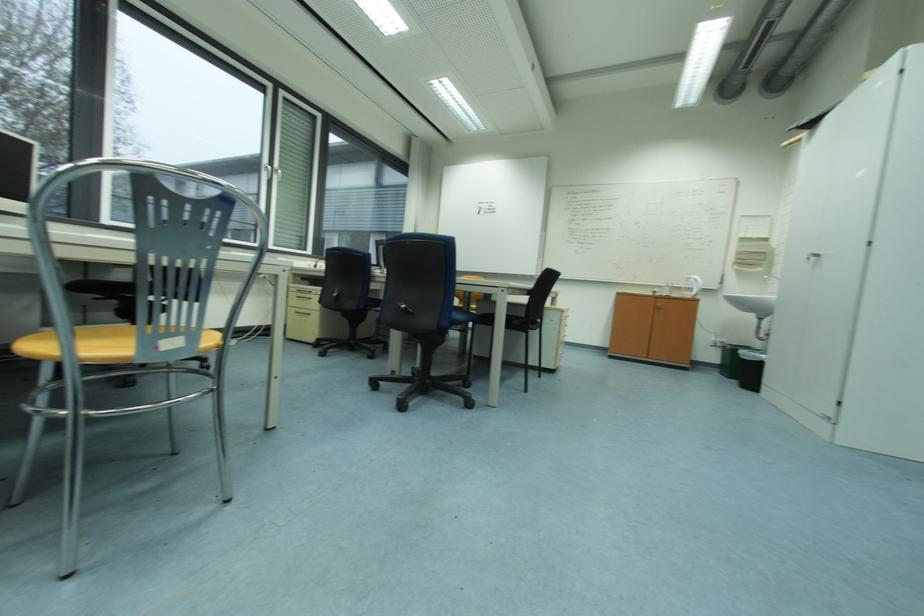
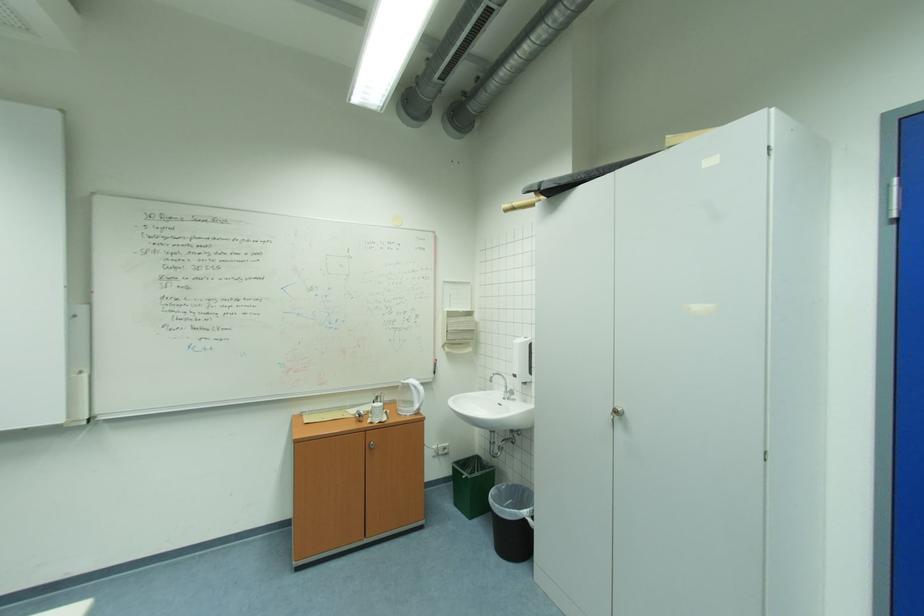
Locate, in the second image, the point that corresponds to (x=732, y=376) in the first image.

(464, 505)